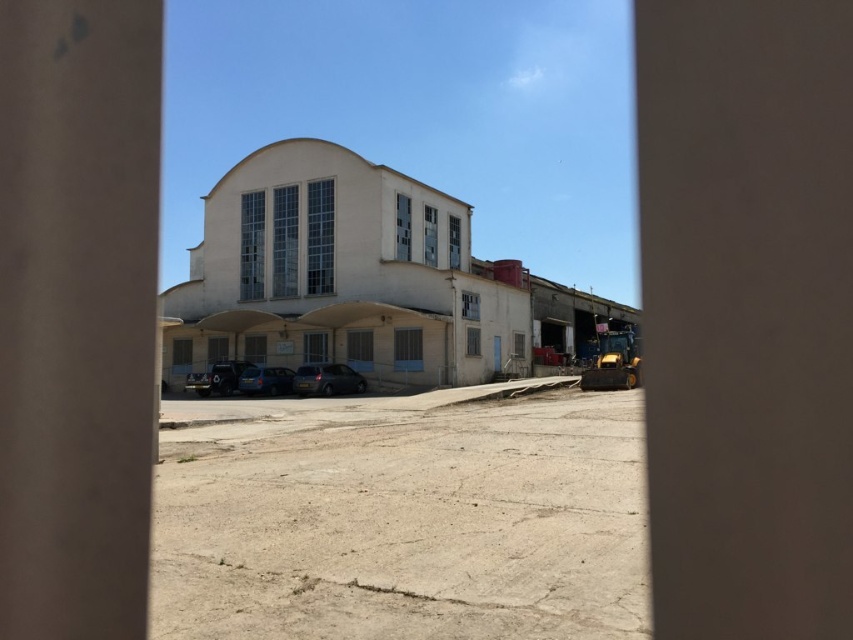
What do you see at coordinates (77, 314) in the screenshot? I see `smooth concrete pillar at center` at bounding box center [77, 314].

What do you see at coordinates (77, 314) in the screenshot? I see `smooth concrete pillar at center` at bounding box center [77, 314].

Find the location of `smooth concrete pillar at center`. smooth concrete pillar at center is located at coordinates (77, 314).

Can you confirm if shiny black car at center is thinner than matte blue van at center?

Correct, shiny black car at center's width is less than matte blue van at center's.

Between point (199, 390) and point (242, 378), which one is positioned behind?

The point (199, 390) is behind.

Where is `shiny black car at center`? This screenshot has width=853, height=640. shiny black car at center is located at coordinates (218, 378).

Which of these two, satin black car at center or matte blue van at center, stands taller?

satin black car at center is taller.

Image resolution: width=853 pixels, height=640 pixels. What do you see at coordinates (328, 380) in the screenshot?
I see `satin black car at center` at bounding box center [328, 380].

I want to click on satin black car at center, so click(x=328, y=380).